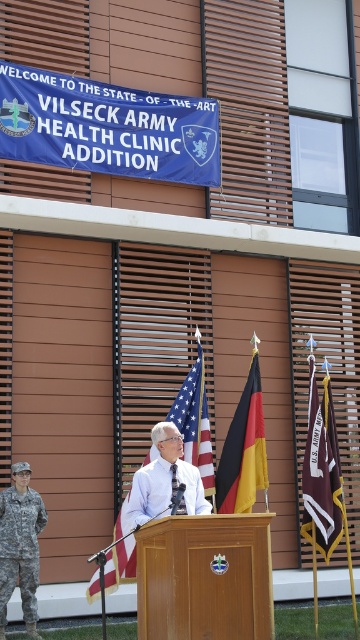
Who is shorter, american flag at center or brown fabric flag at center?

american flag at center is shorter.

How distant is american flag at center from brown fabric flag at center?

A distance of 1.52 meters exists between american flag at center and brown fabric flag at center.

Which is in front, point (173, 412) or point (322, 435)?

Point (322, 435) is in front.

Find the location of a particular element. Image resolution: width=360 pixels, height=640 pixels. american flag at center is located at coordinates (195, 420).

Between point (259, 432) and point (20, 547), which one is positioned in front?

Positioned in front is point (20, 547).

Locate an element on the screen. The width and height of the screenshot is (360, 640). black/yellow/red fabric flag at center is located at coordinates (244, 451).

From the picture: Does black/yellow/red fabric flag at center have a lesser height compared to white cotton shirt at center?

No.

Does point (261, 404) come closer to viewer compared to point (132, 579)?

No, (261, 404) is further to viewer.

Find the location of a particular element. This screenshot has width=360, height=640. black/yellow/red fabric flag at center is located at coordinates (244, 451).